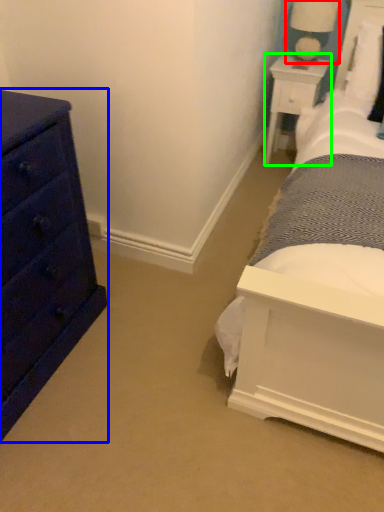
Question: Considering the real-world distances, which object is closest to table lamp (highlighted by a red box)? chest of drawers (highlighted by a blue box) or nightstand (highlighted by a green box).

Choices:
 (A) chest of drawers
 (B) nightstand

Answer: (B)